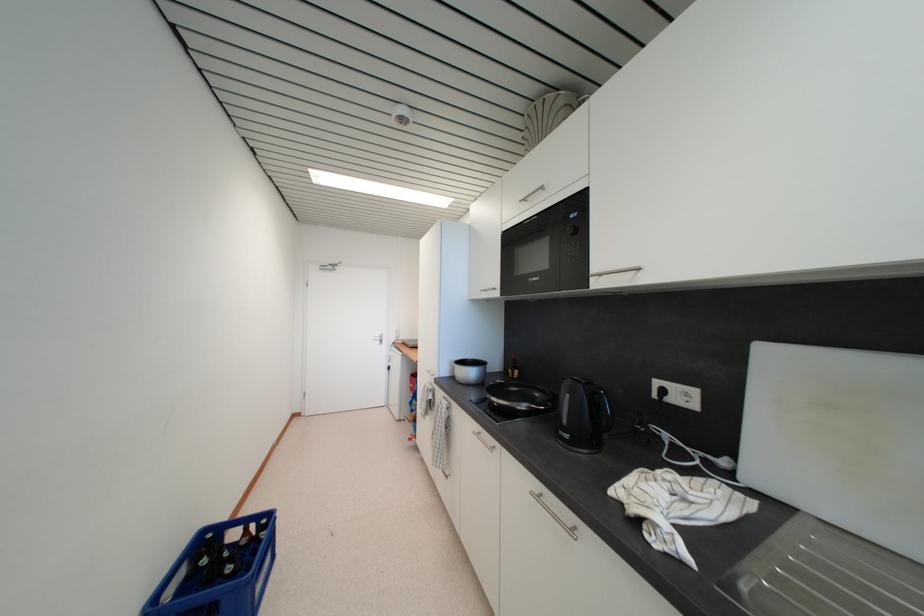
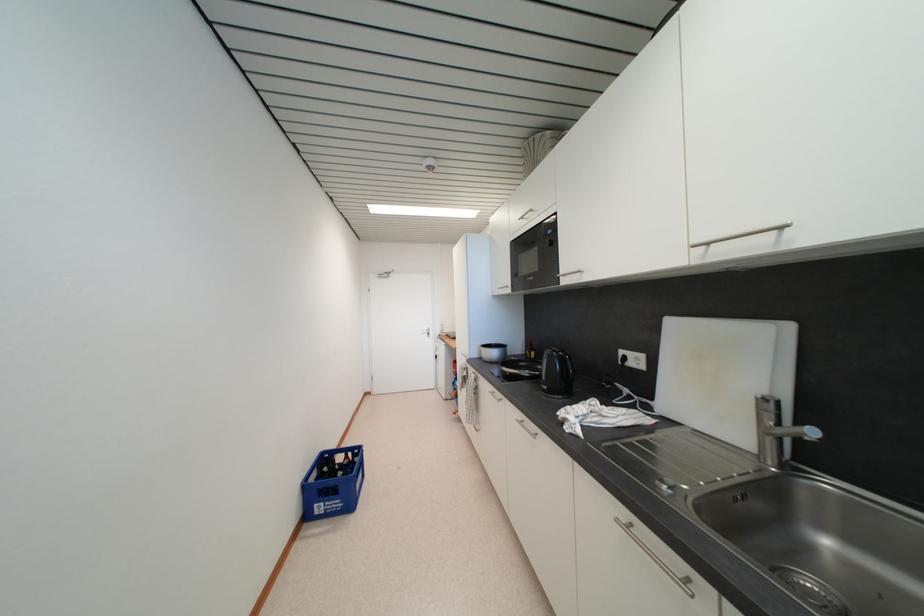
The images are taken continuously from a first-person perspective. In which direction are you moving?

The cameraman moved toward right, backward.